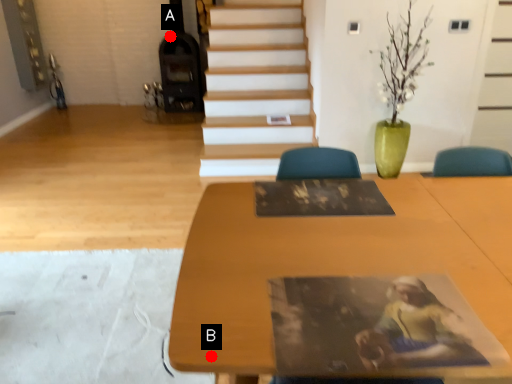
Question: Two points are circled on the image, labeled by A and B beside each circle. Which point is farther to the camera?

Choices:
 (A) A is further
 (B) B is further

Answer: (A)